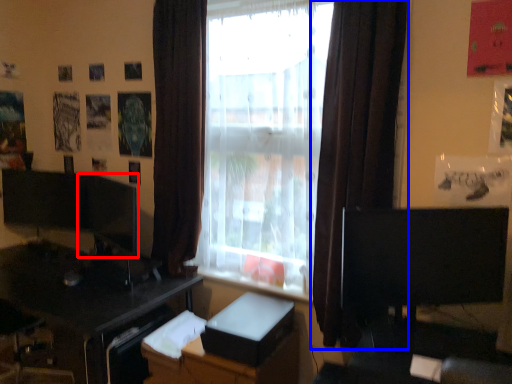
Question: Which of the following is the closest to the observer, computer monitor (highlighted by a red box) or curtain (highlighted by a blue box)?

Choices:
 (A) computer monitor
 (B) curtain

Answer: (B)